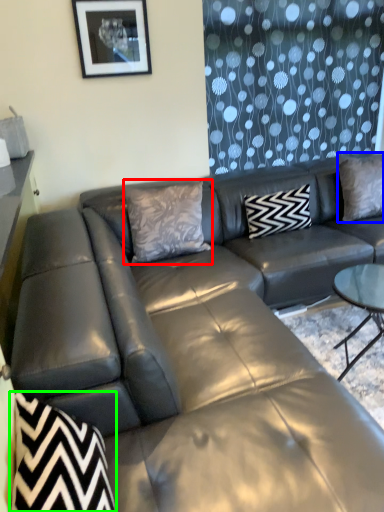
Question: Estimate the real-world distances between objects in this image. Which object is closer to pillow (highlighted by a red box), pillow (highlighted by a blue box) or swivel chair (highlighted by a green box)?

Choices:
 (A) pillow
 (B) swivel chair

Answer: (A)